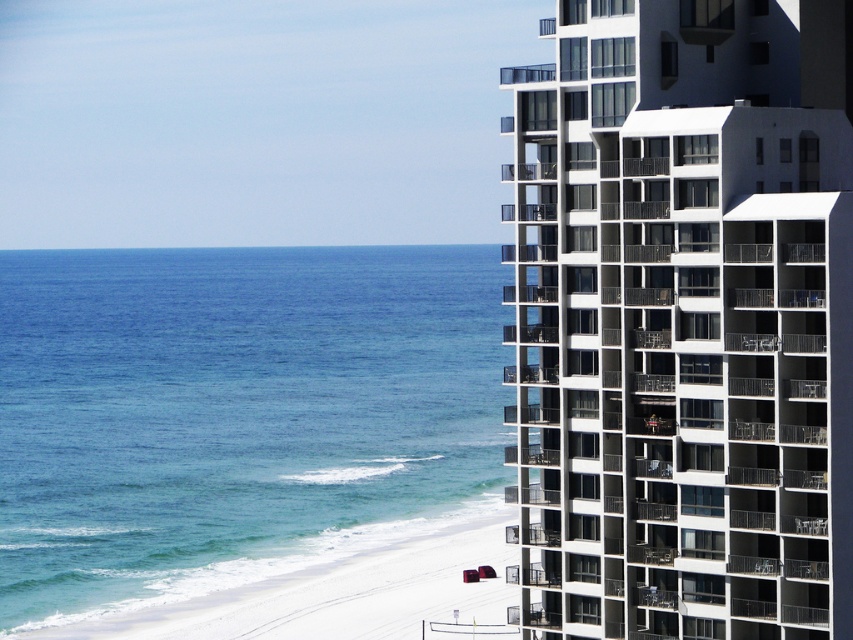
Question: Which is nearer to the white sand at lower left?

Choices:
 (A) blue water at lower left
 (B) white glass building at right

Answer: (B)

Question: Does white glass building at right appear under blue water at lower left?

Choices:
 (A) no
 (B) yes

Answer: (A)

Question: Based on their relative distances, which object is farther from the white sand at lower left?

Choices:
 (A) blue water at lower left
 (B) white glass building at right

Answer: (A)

Question: Is blue water at lower left to the right of white sand at lower left from the viewer's perspective?

Choices:
 (A) no
 (B) yes

Answer: (A)

Question: Can you confirm if white glass building at right is thinner than white sand at lower left?

Choices:
 (A) yes
 (B) no

Answer: (A)

Question: Which object appears closest to the camera in this image?

Choices:
 (A) blue water at lower left
 (B) white glass building at right

Answer: (B)